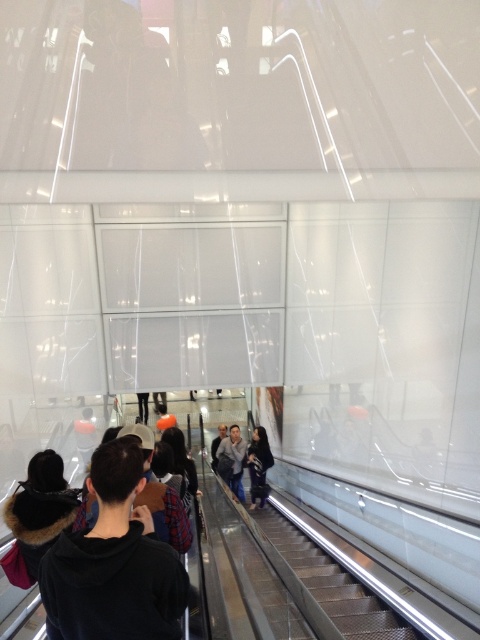
Question: Which is farther from the light gray sweater at center?

Choices:
 (A) dark gray jacket at center
 (B) metallic silver escalator at center
 (C) dark gray sweater at center
 (D) black fur-lined coat at lower left

Answer: (D)

Question: Which object is farther from the camera taking this photo?

Choices:
 (A) black fur-lined coat at lower left
 (B) metallic silver escalator at center
 (C) light gray sweater at center

Answer: (C)

Question: Does black fur-lined coat at lower left appear on the left side of dark gray sweater at center?

Choices:
 (A) no
 (B) yes

Answer: (B)

Question: Based on their relative distances, which object is farther from the black hoodie at center?

Choices:
 (A) metallic silver escalator at center
 (B) light gray sweater at center
 (C) black fur-lined coat at lower left

Answer: (B)

Question: Can you confirm if black hoodie at center is positioned to the left of dark gray sweater at center?

Choices:
 (A) no
 (B) yes

Answer: (B)

Question: Is black hoodie at center thinner than metallic silver escalator at center?

Choices:
 (A) yes
 (B) no

Answer: (A)